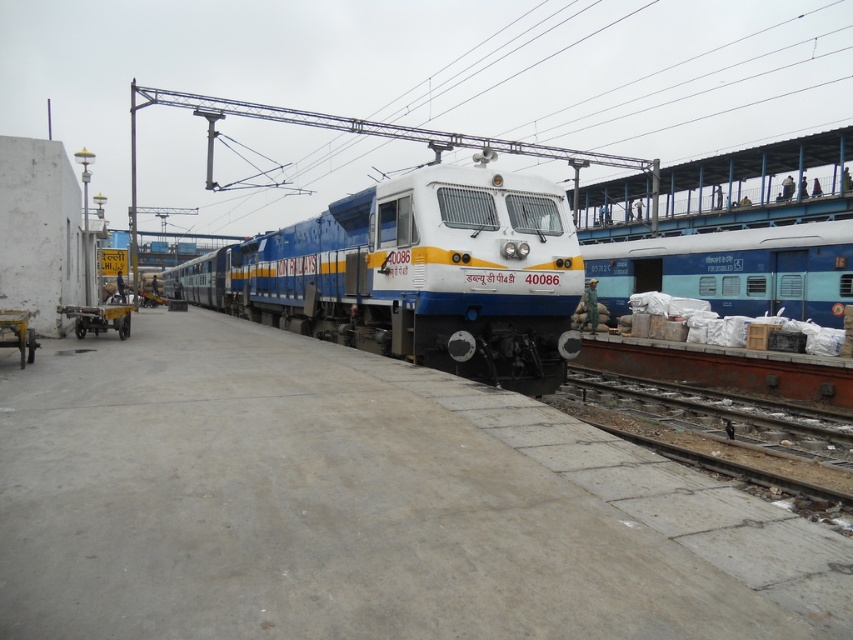
Question: Is white glossy train at center behind rusty metal track at lower right?

Choices:
 (A) yes
 (B) no

Answer: (A)

Question: Does white glossy train at center have a larger size compared to blue matte train at right?

Choices:
 (A) no
 (B) yes

Answer: (B)

Question: Estimate the real-world distances between objects in this image. Which object is closer to the blue matte train at right?

Choices:
 (A) metallic silver cart at left
 (B) white glossy train at center
 (C) rusty metal track at lower right

Answer: (C)

Question: Does blue matte train at right appear under metallic silver cart at left?

Choices:
 (A) yes
 (B) no

Answer: (B)

Question: Which point appears closest to the camera in this image?

Choices:
 (A) (770, 456)
 (B) (311, 260)

Answer: (A)

Question: Which object appears closest to the camera in this image?

Choices:
 (A) white glossy train at center
 (B) metallic silver cart at left
 (C) rusty metal track at lower right
 (D) blue matte train at right

Answer: (C)